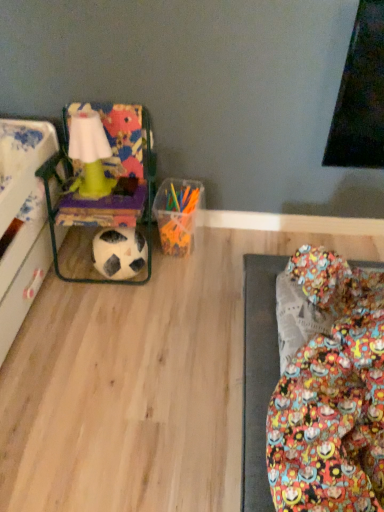
At what (x,y) coordinates should I click in order to perform the action: click on empty space that is ontop of black matte football at lower left (from a real-world perspective). Please return your answer as a coordinate pair (x, y). This screenshot has width=384, height=512. Looking at the image, I should click on point(118,238).